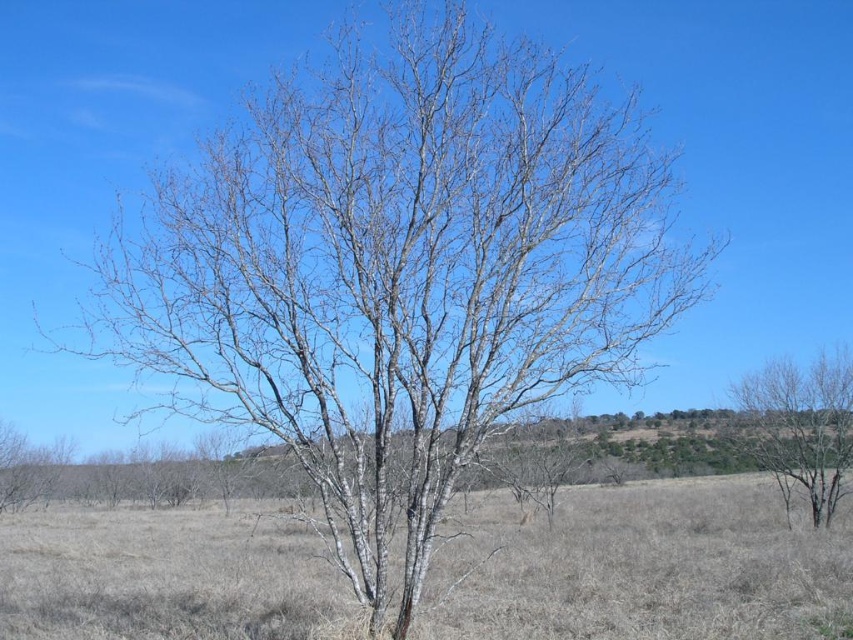
Question: Which object appears farthest from the camera in this image?

Choices:
 (A) dry grass at center
 (B) bare wood tree at right

Answer: (B)

Question: Among these points, which one is farthest from the camera?

Choices:
 (A) (65, 605)
 (B) (786, 413)

Answer: (B)

Question: Can you confirm if dry grass at center is wider than bare wood tree at right?

Choices:
 (A) no
 (B) yes

Answer: (B)

Question: Which object appears farthest from the camera in this image?

Choices:
 (A) bare wood tree at right
 (B) dry grass at center

Answer: (A)

Question: Can you confirm if dry grass at center is bigger than bare wood tree at right?

Choices:
 (A) yes
 (B) no

Answer: (A)

Question: Does dry grass at center have a larger size compared to bare wood tree at right?

Choices:
 (A) no
 (B) yes

Answer: (B)